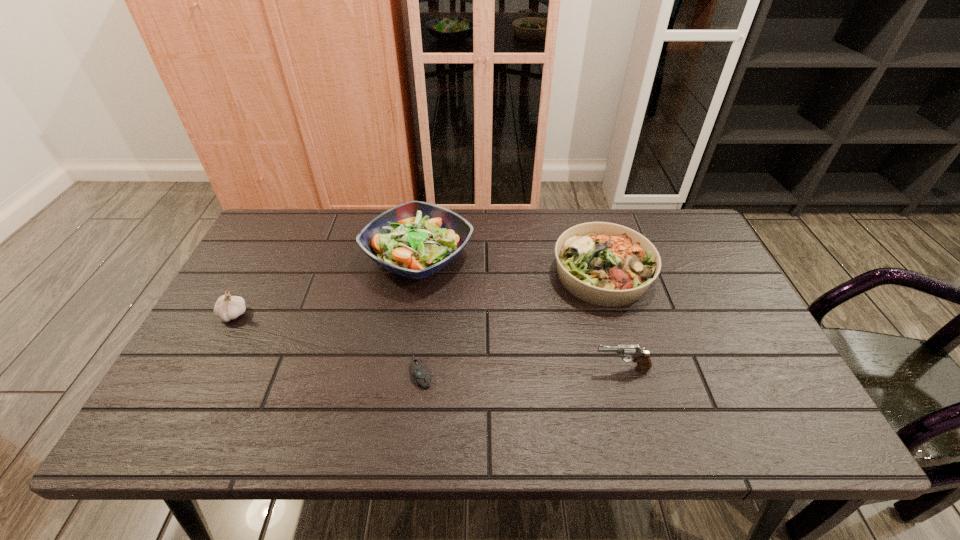
Locate an element on the screen. Image resolution: width=960 pixels, height=540 pixels. blank space located 0.350m at the barrel of the pistol is located at coordinates point(444,368).

This screenshot has height=540, width=960. Find the location of `free space located 0.260m on the front of the right salad plate`. free space located 0.260m on the front of the right salad plate is located at coordinates pos(638,399).

Where is `vacant space located on the right of the shortest object`? This screenshot has width=960, height=540. vacant space located on the right of the shortest object is located at coordinates click(x=479, y=373).

The width and height of the screenshot is (960, 540). Identify the location of object that is at the left edge. (227, 307).

You are a GUI agent. You are given a task and a screenshot of the screen. Output one action in this format:
    pyautogui.click(x=<x>, y=<y>)
    Task: Click on the free point at the far edge
    This screenshot has width=960, height=540.
    Given the screenshot: What is the action you would take?
    pyautogui.click(x=551, y=215)

This screenshot has height=540, width=960. In order to click on vacant space at the near edge of the desktop in this screenshot , I will do `click(530, 408)`.

Image resolution: width=960 pixels, height=540 pixels. Identify the location of free region at the right edge of the desktop. (747, 381).

Locate an element on the screen. The image size is (960, 540). vacant space at the far right corner of the desktop is located at coordinates (689, 241).

Where is `vacant area at the near right corner`? vacant area at the near right corner is located at coordinates (798, 407).

Image resolution: width=960 pixels, height=540 pixels. Find the location of `free space between the pistol and the computer mouse`. free space between the pistol and the computer mouse is located at coordinates (521, 370).